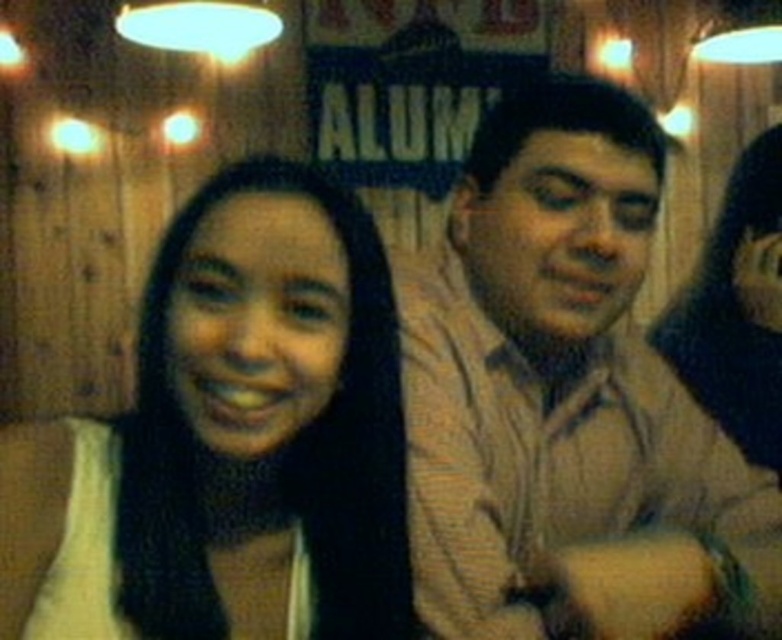
You are a photographer trying to capture a candid shot of the two people in the scene. You notice the light brown shirt at right and the dark brown hair at center. Which object would be easier to focus on due to its size?

The light brown shirt at right has a larger size compared to the dark brown hair at center, so it would be easier to focus on the light brown shirt at right because it is bigger in size.